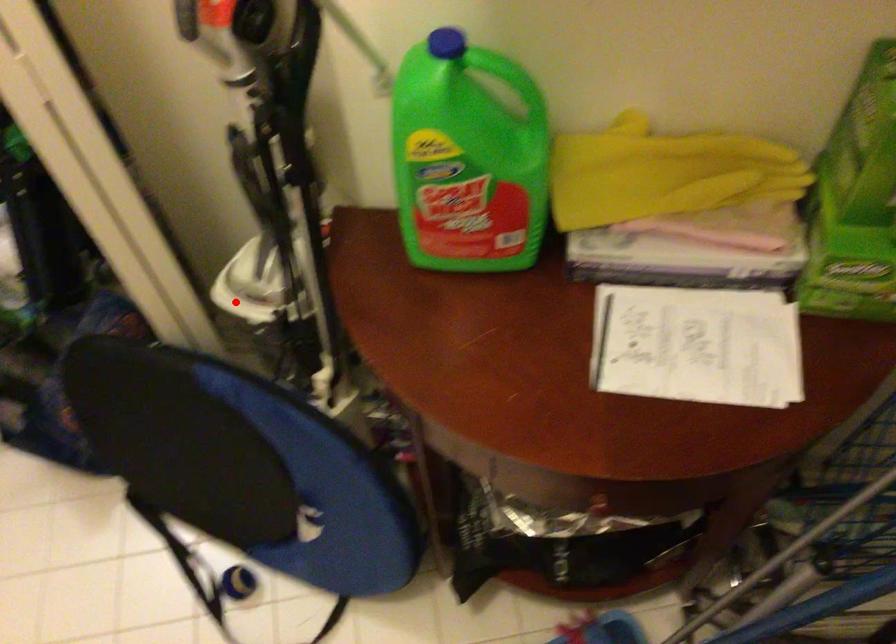
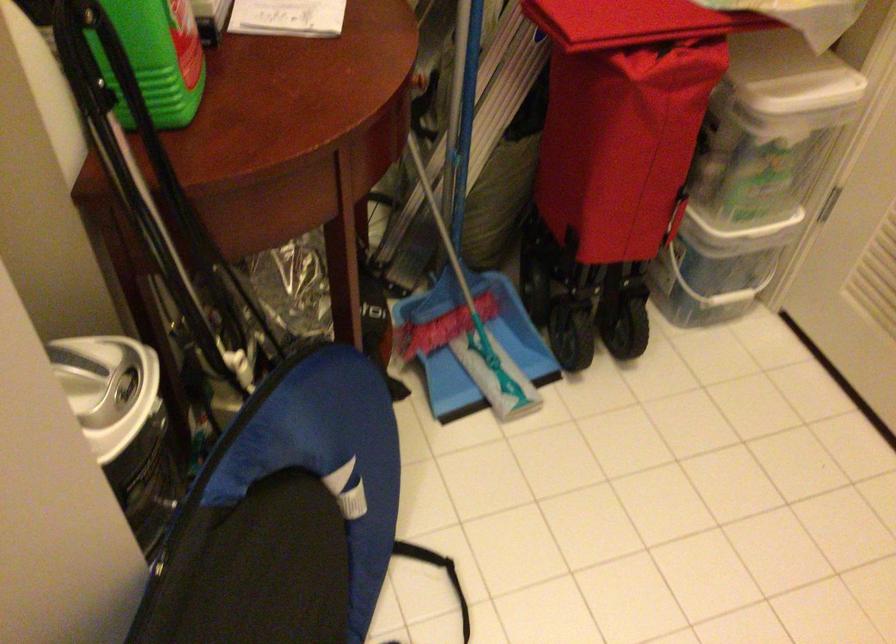
Question: I am providing you with two images of the same scene from different viewpoints. In image1, a red point is highlighted. Considering the same 3D point in image2, which of the following is correct?

Choices:
 (A) It is closer
 (B) It is farther

Answer: (A)